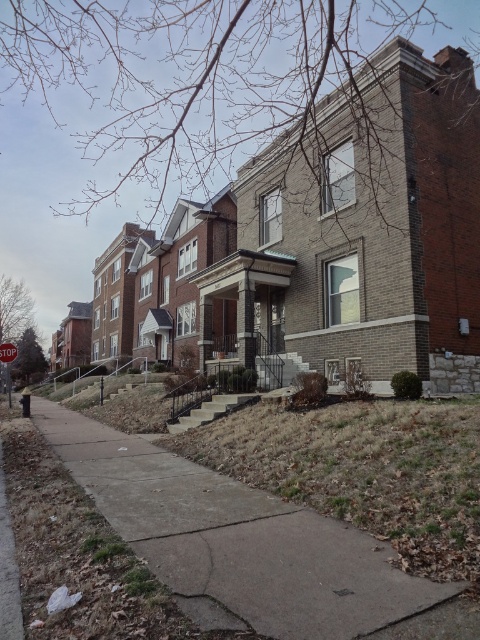
Question: Which object appears closest to the camera in this image?

Choices:
 (A) red plastic stop sign at top
 (B) concrete at lower left
 (C) red stop sign at top

Answer: (B)

Question: Is concrete at lower left positioned in front of red plastic stop sign at top?

Choices:
 (A) yes
 (B) no

Answer: (A)

Question: Is concrete at lower left thinner than red plastic stop sign at top?

Choices:
 (A) no
 (B) yes

Answer: (B)

Question: Estimate the real-world distances between objects in this image. Which object is farther from the red plastic stop sign at top?

Choices:
 (A) red stop sign at top
 (B) concrete at lower left

Answer: (B)

Question: Which of the following is the closest to the observer?

Choices:
 (A) (6, 349)
 (B) (3, 342)
 (C) (200, 508)

Answer: (C)

Question: Is concrete at lower left above red plastic stop sign at top?

Choices:
 (A) no
 (B) yes

Answer: (A)